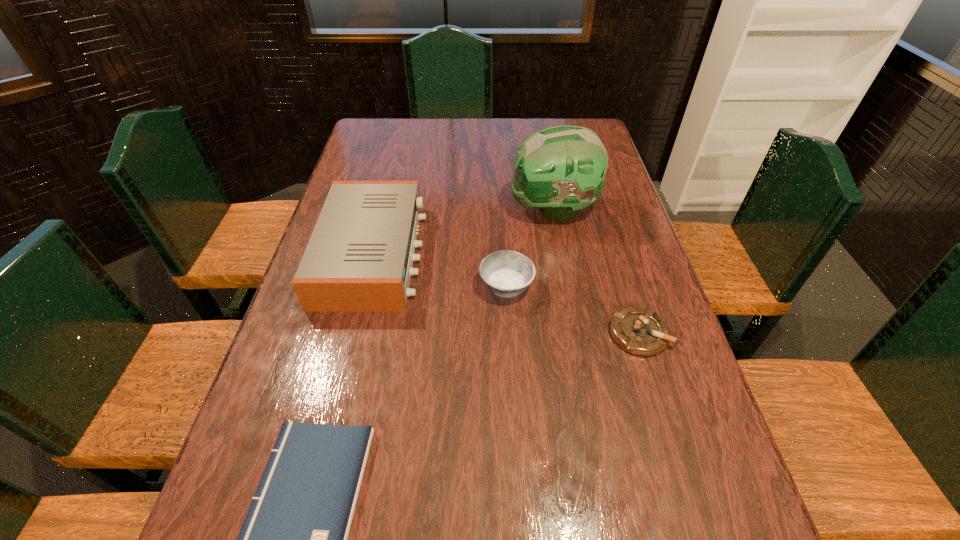
What are the coordinates of `football helmet` in the screenshot? It's located at (560, 170).

Locate an element on the screen. the fourth shortest object is located at coordinates (360, 255).

Identify the location of the left ashtray. (505, 273).

Identify the location of the taller ashtray. (505, 273).

This screenshot has width=960, height=540. I want to click on the nearer ashtray, so [637, 330].

I want to click on the second shortest object, so click(637, 330).

At what (x,y) coordinates should I click in order to perform the action: click on vacant space located 0.370m on the visor of the football helmet. Please return your answer as a coordinate pair (x, y). Image resolution: width=960 pixels, height=540 pixels. Looking at the image, I should click on (390, 210).

The width and height of the screenshot is (960, 540). Identify the location of blank area located on the visor of the football helmet. (432, 210).

Locate an element on the screen. Image resolution: width=960 pixels, height=540 pixels. vacant space located on the visor of the football helmet is located at coordinates (490, 210).

Image resolution: width=960 pixels, height=540 pixels. In order to click on free space located on the control panel of the fourth shortest object in this screenshot , I will do `click(548, 254)`.